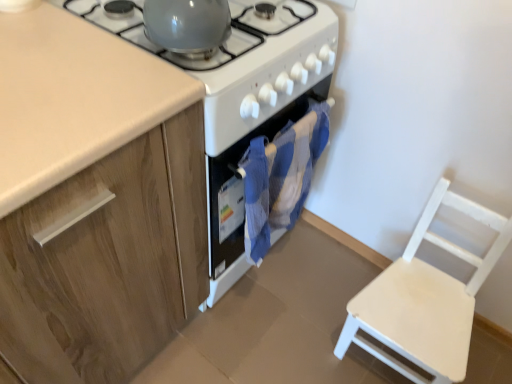
Question: Is white wooden chair at lower right outside wooden cabinet at left?

Choices:
 (A) no
 (B) yes

Answer: (B)

Question: Considering the relative sizes of white wooden chair at lower right and wooden cabinet at left in the image provided, is white wooden chair at lower right smaller than wooden cabinet at left?

Choices:
 (A) yes
 (B) no

Answer: (A)

Question: Is the surface of white wooden chair at lower right in direct contact with wooden cabinet at left?

Choices:
 (A) yes
 (B) no

Answer: (B)

Question: Is white wooden chair at lower right positioned in front of wooden cabinet at left?

Choices:
 (A) yes
 (B) no

Answer: (B)

Question: Is white wooden chair at lower right behind wooden cabinet at left?

Choices:
 (A) yes
 (B) no

Answer: (A)

Question: Is wooden cabinet at left located within white wooden chair at lower right?

Choices:
 (A) yes
 (B) no

Answer: (B)

Question: Is white glossy gas stove at center, the first gas stove positioned from the left, to the left of glossy ceramic kettle at upper center, the 2th gas stove viewed from the left, from the viewer's perspective?

Choices:
 (A) yes
 (B) no

Answer: (A)

Question: Is white glossy gas stove at center, which ranks as the 2th gas stove in right-to-left order, positioned behind glossy ceramic kettle at upper center, the 2th gas stove viewed from the left?

Choices:
 (A) no
 (B) yes

Answer: (A)

Question: From the image's perspective, would you say white glossy gas stove at center, the first gas stove positioned from the left, is shown under glossy ceramic kettle at upper center, the 2th gas stove viewed from the left?

Choices:
 (A) no
 (B) yes

Answer: (A)

Question: Could you tell me if white glossy gas stove at center, which ranks as the 2th gas stove in right-to-left order, is turned towards glossy ceramic kettle at upper center, acting as the first gas stove starting from the right?

Choices:
 (A) no
 (B) yes

Answer: (B)

Question: Does white glossy gas stove at center, the first gas stove positioned from the left, lie in front of glossy ceramic kettle at upper center, the 2th gas stove viewed from the left?

Choices:
 (A) yes
 (B) no

Answer: (A)

Question: Is white glossy gas stove at center, which ranks as the 2th gas stove in right-to-left order, beside glossy ceramic kettle at upper center, the 2th gas stove viewed from the left?

Choices:
 (A) yes
 (B) no

Answer: (A)

Question: Can you confirm if wooden cabinet at left is taller than blue fabric oven at center?

Choices:
 (A) no
 (B) yes

Answer: (B)